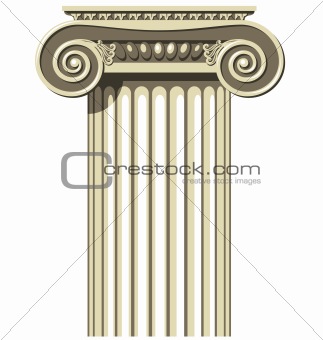
This screenshot has width=323, height=340. What are the coordinates of `top front left corner of column` in the screenshot? It's located at (62, 8).